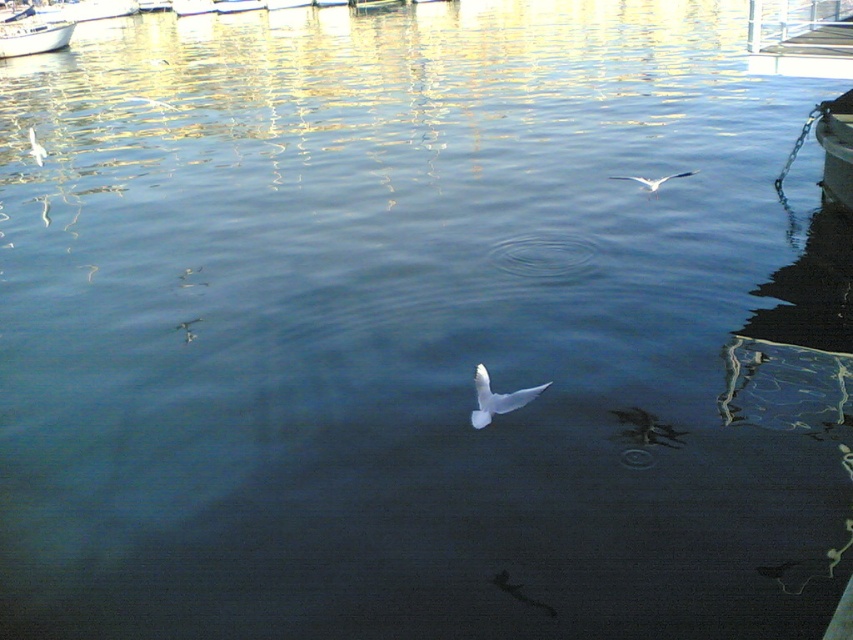
Question: Is metallic silver boat at right bigger than white matte bird at upper left?

Choices:
 (A) yes
 (B) no

Answer: (A)

Question: Which point appears farthest from the camera in this image?

Choices:
 (A) (38, 35)
 (B) (654, 188)
 (C) (33, 147)
 (D) (505, 410)

Answer: (A)

Question: Is white glossy boat at upper left to the right of white feathered bird at upper right from the viewer's perspective?

Choices:
 (A) yes
 (B) no

Answer: (B)

Question: Does white glossy boat at upper left appear over white matte bird at upper left?

Choices:
 (A) yes
 (B) no

Answer: (A)

Question: Which point appears closest to the camera in this image?

Choices:
 (A) (476, 412)
 (B) (38, 141)
 (C) (16, 29)
 (D) (842, 196)

Answer: (A)

Question: Among these points, which one is nearest to the camera?

Choices:
 (A) (160, 104)
 (B) (473, 410)

Answer: (B)